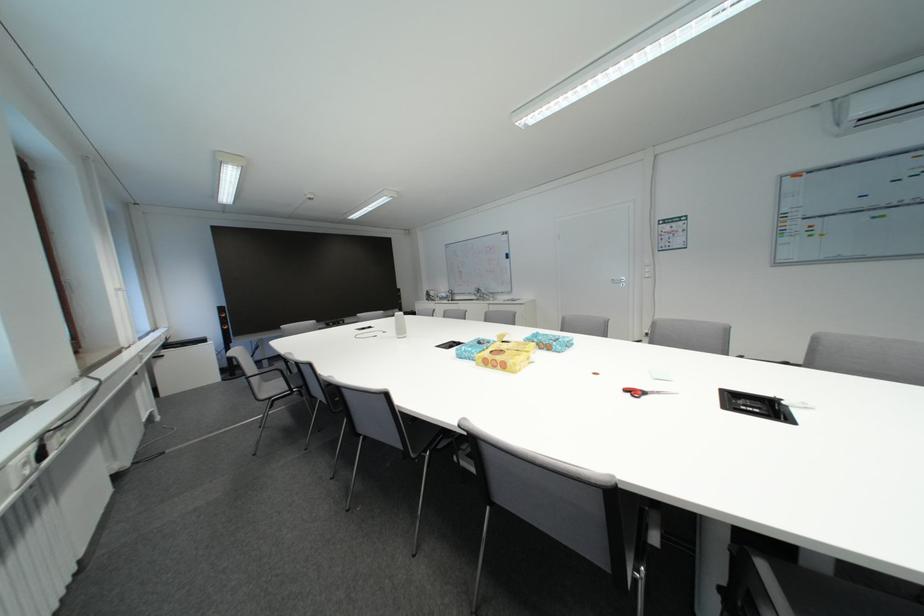
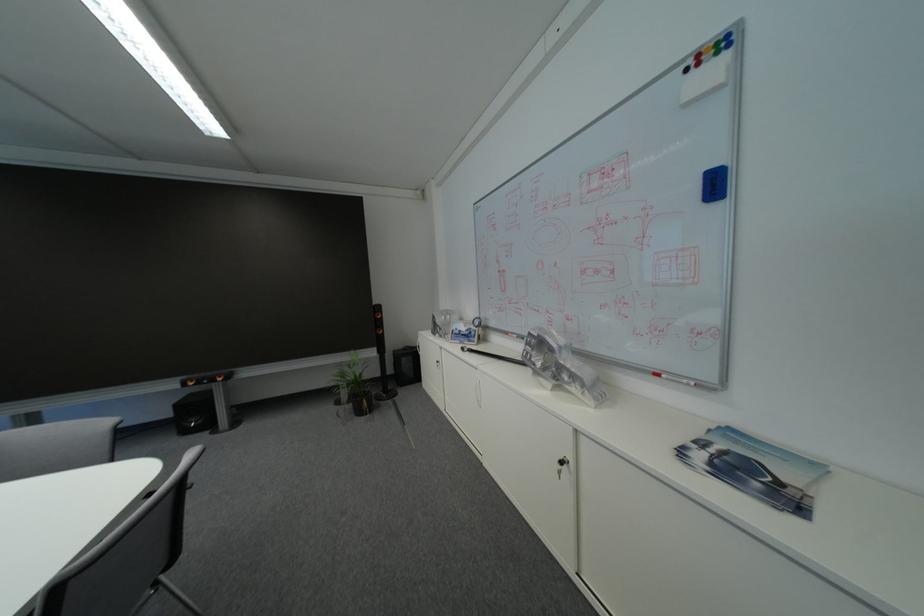
Locate, in the second image, the point that corresponds to the point at 517,259 in the first image.

(726, 188)